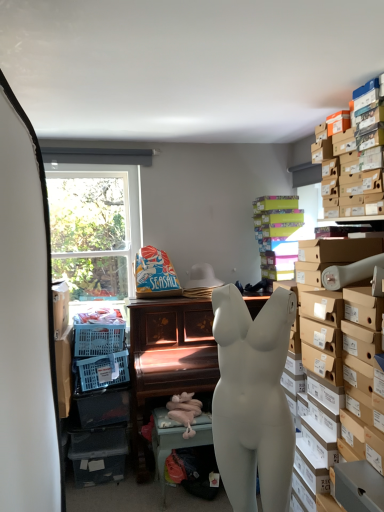
Question: Considering the positions of seaside-themed paper bag at center, placed as the 1th toy when sorted from top to bottom, and pink fabric toy at lower center, the 2th toy from the top, in the image, is seaside-themed paper bag at center, placed as the 1th toy when sorted from top to bottom, bigger or smaller than pink fabric toy at lower center, the 2th toy from the top,?

Choices:
 (A) big
 (B) small

Answer: (A)

Question: Looking at their shapes, would you say seaside-themed paper bag at center, the 2th toy when ordered from front to back, is wider or thinner than pink fabric toy at lower center, the 1th toy positioned from the front?

Choices:
 (A) wide
 (B) thin

Answer: (A)

Question: Which object is positioned closest to the wooden piano at center, the first table viewed from the back?

Choices:
 (A) seaside-themed paper bag at center, the 2th toy positioned from the bottom
 (B) pink fabric toy at lower center, the 2th toy from the top
 (C) white matte table at lower center, acting as the 2th table starting from the back
 (D) multicolored cardboard boxes at upper right, placed as the 2th shelf when sorted from front to back
 (E) white matte mannequin torso at center

Answer: (B)

Question: Estimate the real-world distances between objects in this image. Which object is closer to the pink fabric toy at lower center, the 1th toy positioned from the front?

Choices:
 (A) brown cardboard boxes at upper right, which is the second shelf from back to front
 (B) seaside-themed paper bag at center, the 2th toy positioned from the bottom
 (C) white matte table at lower center, acting as the 2th table starting from the back
 (D) wooden piano at center, which is the 2th table from front to back
 (E) multicolored cardboard boxes at upper right, placed as the 2th shelf when sorted from front to back

Answer: (C)